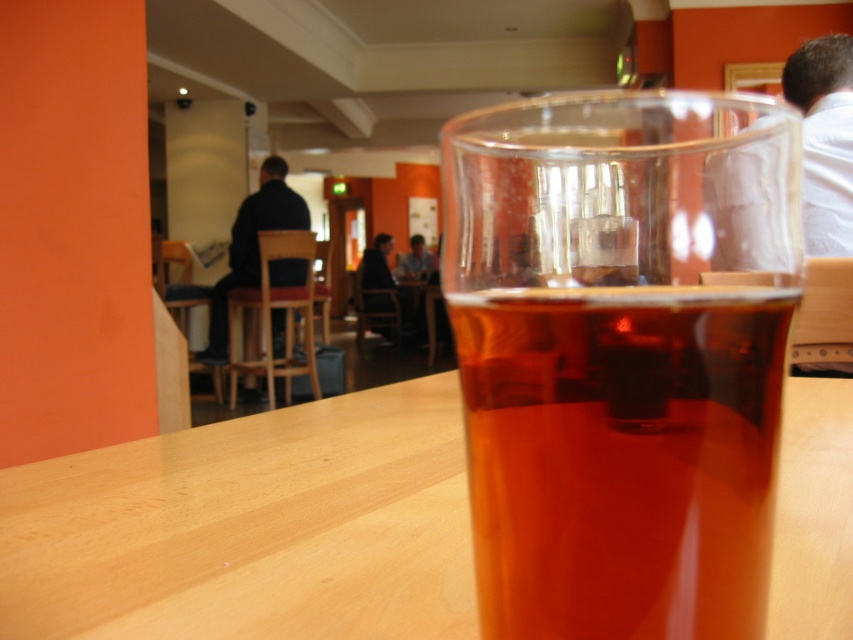
Is translucent glass at center smaller than light wood table at center?

Yes, translucent glass at center is smaller than light wood table at center.

Is point (500, 284) closer to viewer compared to point (366, 605)?

Yes, point (500, 284) is in front of point (366, 605).

Locate an element on the screen. translucent glass at center is located at coordinates (621, 355).